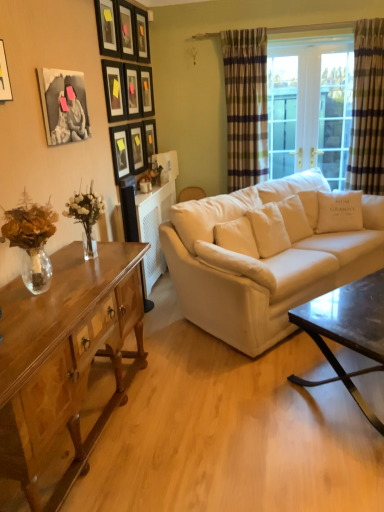
Question: Should I look upward or downward to see matte black picture frame at center, the 1th picture frame positioned from the back?

Choices:
 (A) up
 (B) down

Answer: (A)

Question: Is matte black picture frame at upper center, which is counted as the second picture frame, starting from the back, beside plaid fabric curtain at right, the 1th curtain when ordered from right to left?

Choices:
 (A) yes
 (B) no

Answer: (B)

Question: Is matte black picture frame at upper center, which is counted as the second picture frame, starting from the back, facing away from plaid fabric curtain at right, the 1th curtain when ordered from right to left?

Choices:
 (A) no
 (B) yes

Answer: (A)

Question: Considering the relative positions of matte black picture frame at upper center, which is counted as the second picture frame, starting from the back, and plaid fabric curtain at right, the 1th curtain when ordered from right to left, in the image provided, is matte black picture frame at upper center, which is counted as the second picture frame, starting from the back, to the left of plaid fabric curtain at right, the 1th curtain when ordered from right to left, from the viewer's perspective?

Choices:
 (A) no
 (B) yes

Answer: (B)

Question: Considering the relative sizes of matte black picture frame at upper center, which is counted as the second picture frame, starting from the back, and plaid fabric curtain at right, which appears as the 2th curtain when viewed from the left, in the image provided, is matte black picture frame at upper center, which is counted as the second picture frame, starting from the back, bigger than plaid fabric curtain at right, which appears as the 2th curtain when viewed from the left,?

Choices:
 (A) no
 (B) yes

Answer: (A)

Question: Can you confirm if matte black picture frame at upper center, which is counted as the second picture frame, starting from the back, is wider than plaid fabric curtain at right, which appears as the 2th curtain when viewed from the left?

Choices:
 (A) no
 (B) yes

Answer: (A)

Question: From a real-world perspective, does matte black picture frame at upper center, which is counted as the second picture frame, starting from the back, sit lower than plaid fabric curtain at right, which appears as the 2th curtain when viewed from the left?

Choices:
 (A) yes
 (B) no

Answer: (B)

Question: Can you confirm if matte black picture frame at upper center, the fifth picture frame positioned from the back, is positioned to the left of light brown fabric armchair at center?

Choices:
 (A) yes
 (B) no

Answer: (A)

Question: Can you confirm if matte black picture frame at upper center, the fifth picture frame positioned from the back, is wider than light brown fabric armchair at center?

Choices:
 (A) no
 (B) yes

Answer: (B)

Question: Could you tell me if matte black picture frame at upper center, the fifth picture frame positioned from the back, is turned towards light brown fabric armchair at center?

Choices:
 (A) yes
 (B) no

Answer: (B)

Question: Can you see matte black picture frame at upper center, positioned as the sixth picture frame in front-to-back order, touching light brown fabric armchair at center?

Choices:
 (A) no
 (B) yes

Answer: (A)

Question: Is matte black picture frame at upper center, the fifth picture frame positioned from the back, not close to light brown fabric armchair at center?

Choices:
 (A) yes
 (B) no

Answer: (A)

Question: Is matte black picture frame at upper center, positioned as the sixth picture frame in front-to-back order, located outside light brown fabric armchair at center?

Choices:
 (A) yes
 (B) no

Answer: (A)

Question: From a real-world perspective, is wooden picture frame at upper left, which is the 5th picture frame from front to back, positioned under black matte picture frame at upper left, positioned as the 1th picture frame in front-to-back order, based on gravity?

Choices:
 (A) no
 (B) yes

Answer: (A)